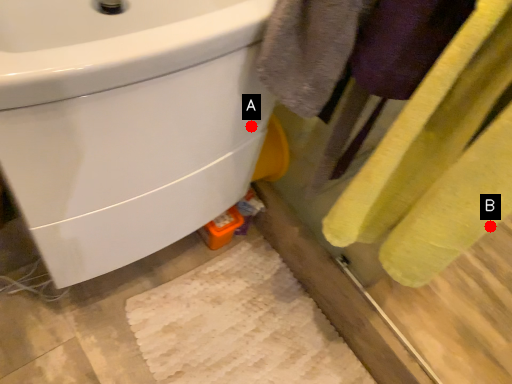
Question: Two points are circled on the image, labeled by A and B beside each circle. Which point is further to the camera?

Choices:
 (A) A is further
 (B) B is further

Answer: (A)